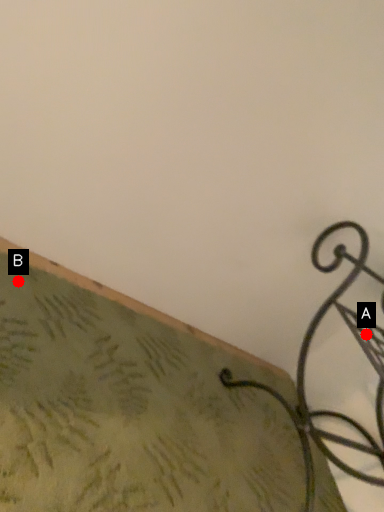
Question: Two points are circled on the image, labeled by A and B beside each circle. Which point is farther from the camera taking this photo?

Choices:
 (A) A is further
 (B) B is further

Answer: (A)